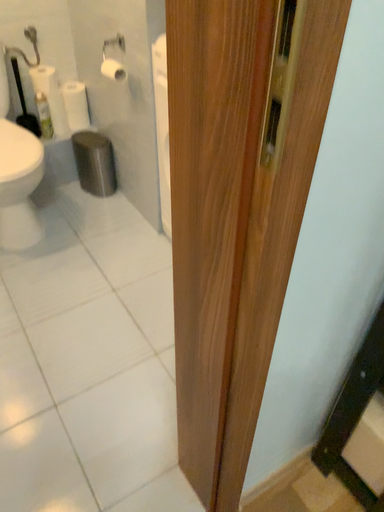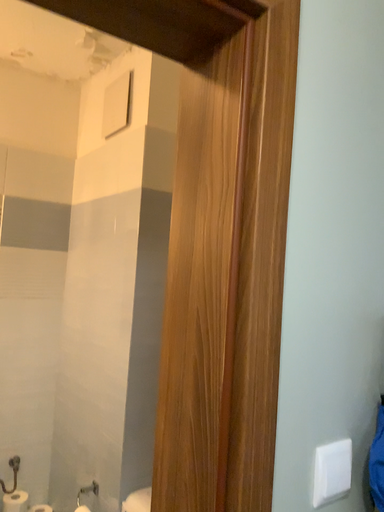
Question: How did the camera likely rotate when shooting the video?

Choices:
 (A) rotated downward
 (B) rotated upward

Answer: (B)